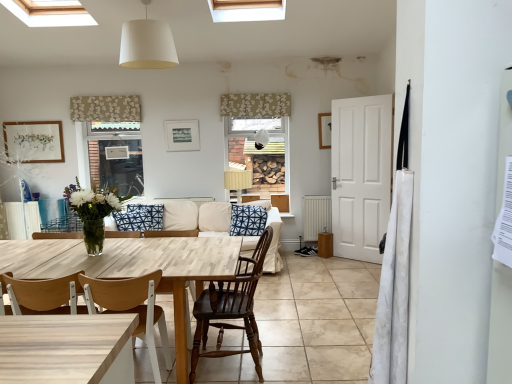
Find the location of `white matte radiator at lower center`. white matte radiator at lower center is located at coordinates (316, 216).

The image size is (512, 384). Find the location of `white fabric lampshade at upper center, the 2th lamp from the bottom`. white fabric lampshade at upper center, the 2th lamp from the bottom is located at coordinates (261, 139).

This screenshot has height=384, width=512. What are the coordinates of `light wood/wooden chair at center, marked as the first chair in a left-to-right arrangement` in the screenshot? It's located at (132, 309).

The image size is (512, 384). What do you see at coordinates (247, 220) in the screenshot?
I see `blue printed cushion at center` at bounding box center [247, 220].

The image size is (512, 384). I want to click on woven fabric lampshade at center, arranged as the 1th lamp when ordered from the bottom, so click(x=237, y=181).

What's the angular difference between beige floral fabric at upper left, the 2th curtain when ordered from bottom to top, and white fabric curtain at right, the 3th curtain from the back,'s facing directions?

91.4 degrees.

Is beige floral fabric at upper left, which is the third curtain from front to back, facing away from white fabric curtain at right, the 3th curtain from the back?

No, beige floral fabric at upper left, which is the third curtain from front to back, is not facing away from white fabric curtain at right, the 3th curtain from the back.

How far apart are beige floral fabric at upper left, the 2th curtain when ordered from bottom to top, and white fabric curtain at right, arranged as the 1th curtain when viewed from the front?

They are 17.36 feet apart.

Is beige floral fabric at upper left, arranged as the first curtain when viewed from the back, smaller than white fabric curtain at right, the third curtain from the left?

Actually, beige floral fabric at upper left, arranged as the first curtain when viewed from the back, might be larger than white fabric curtain at right, the third curtain from the left.

How distant is beige fabric couch at center from white fabric lampshade at upper center, the 1th lamp positioned from the left?

They are 7.44 feet apart.

Considering the relative sizes of beige fabric couch at center and white fabric lampshade at upper center, marked as the 1th lamp in a top-to-bottom arrangement, in the image provided, is beige fabric couch at center wider than white fabric lampshade at upper center, marked as the 1th lamp in a top-to-bottom arrangement,?

Indeed, beige fabric couch at center has a greater width compared to white fabric lampshade at upper center, marked as the 1th lamp in a top-to-bottom arrangement.

Between point (280, 230) and point (156, 30), which one is positioned in front?

The point (156, 30) is closer to the camera.

Which is more to the left, mahogany wood chair at center, which appears as the second chair when viewed from the left, or beige fabric couch at center?

beige fabric couch at center.

From the image's perspective, which is below, mahogany wood chair at center, the first chair positioned from the right, or beige fabric couch at center?

From the image's view, mahogany wood chair at center, the first chair positioned from the right, is below.

Is mahogany wood chair at center, which appears as the second chair when viewed from the left, taller than beige fabric couch at center?

Yes.

Does mahogany wood chair at center, which appears as the second chair when viewed from the left, come behind beige fabric couch at center?

No, mahogany wood chair at center, which appears as the second chair when viewed from the left, is closer to the viewer.

Consider the image. Is light wood table at center to the right of matte gold picture frame at upper left, which is the first picture frame from left to right, from the viewer's perspective?

Yes, light wood table at center is to the right of matte gold picture frame at upper left, which is the first picture frame from left to right.

Considering the positions of objects light wood table at center and matte gold picture frame at upper left, which ranks as the 2th picture frame in right-to-left order, in the image provided, who is in front, light wood table at center or matte gold picture frame at upper left, which ranks as the 2th picture frame in right-to-left order,?

light wood table at center.

Is light wood table at center not close to matte gold picture frame at upper left, which is the first picture frame from left to right?

light wood table at center is far away from matte gold picture frame at upper left, which is the first picture frame from left to right.

Which of these two, light wood table at center or matte gold picture frame at upper left, which is the first picture frame from left to right, is bigger?

light wood table at center.

From the image's perspective, would you say blue printed cushion at center is shown under brown wood cabinet at center?

Indeed, from the image's perspective, blue printed cushion at center is shown beneath brown wood cabinet at center.

Considering the positions of points (247, 228) and (284, 202), is point (247, 228) closer to camera compared to point (284, 202)?

Yes, it is in front of point (284, 202).

Is blue printed cushion at center situated inside brown wood cabinet at center or outside?

blue printed cushion at center is not enclosed by brown wood cabinet at center.

Which object is positioned more to the left, blue printed cushion at center or brown wood cabinet at center?

blue printed cushion at center.

Which point is more distant from viewer, (120, 58) or (120, 113)?

Positioned behind is point (120, 113).

Considering the sizes of objects white fabric lampshade at upper center, which appears as the third lamp when viewed from the back, and beige floral fabric at upper left, arranged as the first curtain when viewed from the back, in the image provided, who is bigger, white fabric lampshade at upper center, which appears as the third lamp when viewed from the back, or beige floral fabric at upper left, arranged as the first curtain when viewed from the back,?

With larger size is white fabric lampshade at upper center, which appears as the third lamp when viewed from the back.

Between white fabric lampshade at upper center, marked as the third lamp in a right-to-left arrangement, and beige floral fabric at upper left, the 2th curtain when ordered from bottom to top, which one has smaller width?

beige floral fabric at upper left, the 2th curtain when ordered from bottom to top.

Which of these two, matte gold picture frame at upper left, which is the first picture frame from left to right, or white fabric lampshade at upper center, the 2th lamp from the bottom, is wider?

white fabric lampshade at upper center, the 2th lamp from the bottom.

Considering the relative positions of matte gold picture frame at upper left, which is the first picture frame from left to right, and white fabric lampshade at upper center, acting as the second lamp starting from the top, in the image provided, is matte gold picture frame at upper left, which is the first picture frame from left to right, to the left of white fabric lampshade at upper center, acting as the second lamp starting from the top, from the viewer's perspective?

Correct, you'll find matte gold picture frame at upper left, which is the first picture frame from left to right, to the left of white fabric lampshade at upper center, acting as the second lamp starting from the top.

Considering the relative sizes of matte gold picture frame at upper left, which ranks as the 2th picture frame in right-to-left order, and white fabric lampshade at upper center, arranged as the first lamp when viewed from the right, in the image provided, is matte gold picture frame at upper left, which ranks as the 2th picture frame in right-to-left order, bigger than white fabric lampshade at upper center, arranged as the first lamp when viewed from the right,?

Yes, matte gold picture frame at upper left, which ranks as the 2th picture frame in right-to-left order, is bigger than white fabric lampshade at upper center, arranged as the first lamp when viewed from the right.

At what (x,y) coordinates should I click in order to perform the action: click on the 2nd curtain counting from the left side of the white fabric curtain at right, arranged as the 1th curtain when viewed from the front. Please return your answer as a coordinate pair (x, y). The image size is (512, 384). Looking at the image, I should click on (105, 108).

Identify the location of lamp in front of the beige fabric couch at center. The width and height of the screenshot is (512, 384). (147, 44).

When comparing their distances from white fabric lampshade at upper center, marked as the third lamp in a right-to-left arrangement, does light wood/wooden chair at center, marked as the first chair in a left-to-right arrangement, or woven fabric lampshade at center, acting as the second lamp starting from the back, seem further?

woven fabric lampshade at center, acting as the second lamp starting from the back.

Estimate the real-world distances between objects in this image. Which object is further from beige floral fabric at upper left, which ranks as the 1th curtain in left-to-right order, white matte picture frame at upper center, which is the second picture frame in left-to-right order, or matte gold picture frame at upper left, which is the first picture frame from left to right?

white matte picture frame at upper center, which is the second picture frame in left-to-right order.

Considering their positions, is mahogany wood chair at center, which appears as the second chair when viewed from the left, positioned further to blue printed cushion at center than white fabric curtain at right, arranged as the first curtain when viewed from the right?

white fabric curtain at right, arranged as the first curtain when viewed from the right, lies further to blue printed cushion at center than the other object.

Looking at the image, which one is located further to woven fabric lampshade at center, placed as the 2th lamp when sorted from left to right, white matte radiator at lower center or beige floral fabric at upper left, which ranks as the 1th curtain in left-to-right order?

beige floral fabric at upper left, which ranks as the 1th curtain in left-to-right order, lies further to woven fabric lampshade at center, placed as the 2th lamp when sorted from left to right, than the other object.

From the image, which object appears to be farther from matte gold picture frame at upper left, which is the first picture frame from left to right, blue printed cushion at center or white matte picture frame at upper center, which is the 1th picture frame from right to left?

Based on the image, blue printed cushion at center appears to be further to matte gold picture frame at upper left, which is the first picture frame from left to right.

From the picture: Considering their positions, is beige fabric couch at center positioned closer to matte gold picture frame at upper left, which is the first picture frame from left to right, than beige floral fabric at upper left, which is the third curtain from front to back?

The object closer to matte gold picture frame at upper left, which is the first picture frame from left to right, is beige floral fabric at upper left, which is the third curtain from front to back.

Estimate the real-world distances between objects in this image. Which object is further from floral fabric valance at upper center, placed as the second curtain when sorted from right to left, beige fabric couch at center or white fabric lampshade at upper center, which is the third lamp in bottom-to-top order?

white fabric lampshade at upper center, which is the third lamp in bottom-to-top order.

Estimate the real-world distances between objects in this image. Which object is further from matte gold picture frame at upper left, which ranks as the 2th picture frame in right-to-left order, beige fabric couch at center or white fabric lampshade at upper center, marked as the third lamp in a right-to-left arrangement?

white fabric lampshade at upper center, marked as the third lamp in a right-to-left arrangement, is positioned further to the anchor matte gold picture frame at upper left, which ranks as the 2th picture frame in right-to-left order.

Locate an element on the screen. picture frame located between matte gold picture frame at upper left, which is the first picture frame from left to right, and blue printed cushion at center in the left-right direction is located at coordinates (182, 135).

This screenshot has height=384, width=512. In order to click on studio couch between light wood table at center and white matte radiator at lower center from front to back in this screenshot , I will do `click(194, 216)`.

What are the coordinates of `picture frame between beige floral fabric at upper left, which ranks as the 1th curtain in left-to-right order, and white fabric lampshade at upper center, arranged as the first lamp when viewed from the right` in the screenshot? It's located at (182, 135).

The width and height of the screenshot is (512, 384). I want to click on studio couch that lies between white fabric lampshade at upper center, marked as the 1th lamp in a top-to-bottom arrangement, and mahogany wood chair at center, which appears as the second chair when viewed from the left, from top to bottom, so click(194, 216).